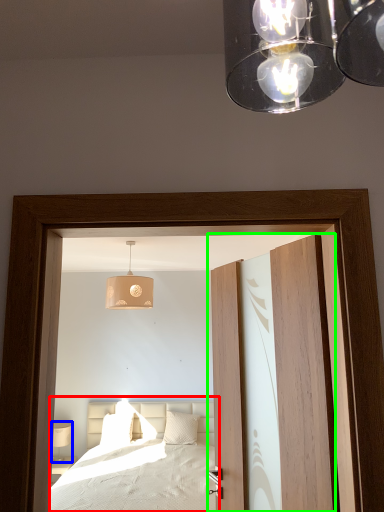
Question: Considering the real-world distances, which object is farthest from bed (highlighted by a red box)? table lamp (highlighted by a blue box) or door (highlighted by a green box)?

Choices:
 (A) table lamp
 (B) door

Answer: (B)